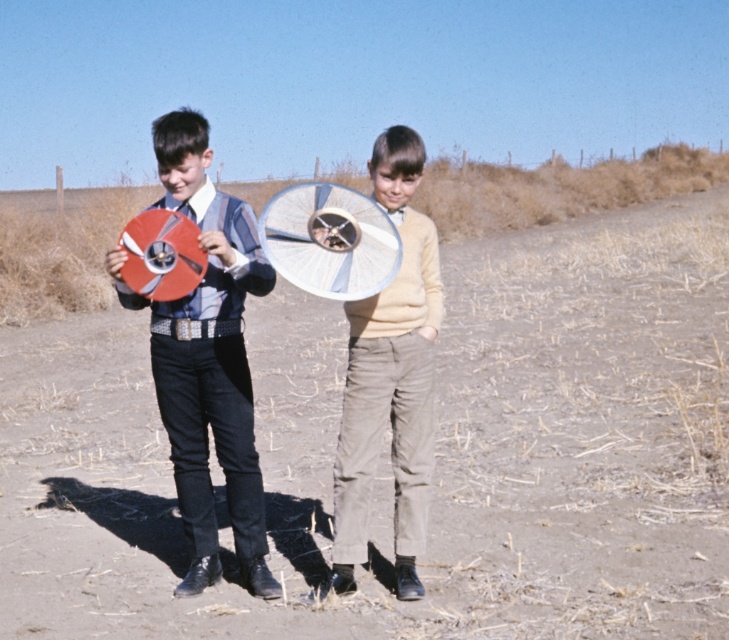
Question: Estimate the real-world distances between objects in this image. Which object is closer to the light beige corduroy pants at center?

Choices:
 (A) dull brown dirt at center
 (B) matte plastic disc at left

Answer: (B)

Question: Which object appears closest to the camera in this image?

Choices:
 (A) light beige corduroy pants at center
 (B) matte plastic disc at left

Answer: (A)

Question: Which of the following is the farthest from the observer?

Choices:
 (A) (219, 362)
 (B) (373, 605)
 (C) (397, 188)

Answer: (A)

Question: Can you confirm if matte plastic disc at left is positioned below light beige corduroy pants at center?

Choices:
 (A) yes
 (B) no

Answer: (B)

Question: Is the position of dull brown dirt at center less distant than that of light beige corduroy pants at center?

Choices:
 (A) no
 (B) yes

Answer: (B)

Question: Is matte plastic disc at left to the right of light beige corduroy pants at center from the viewer's perspective?

Choices:
 (A) no
 (B) yes

Answer: (A)